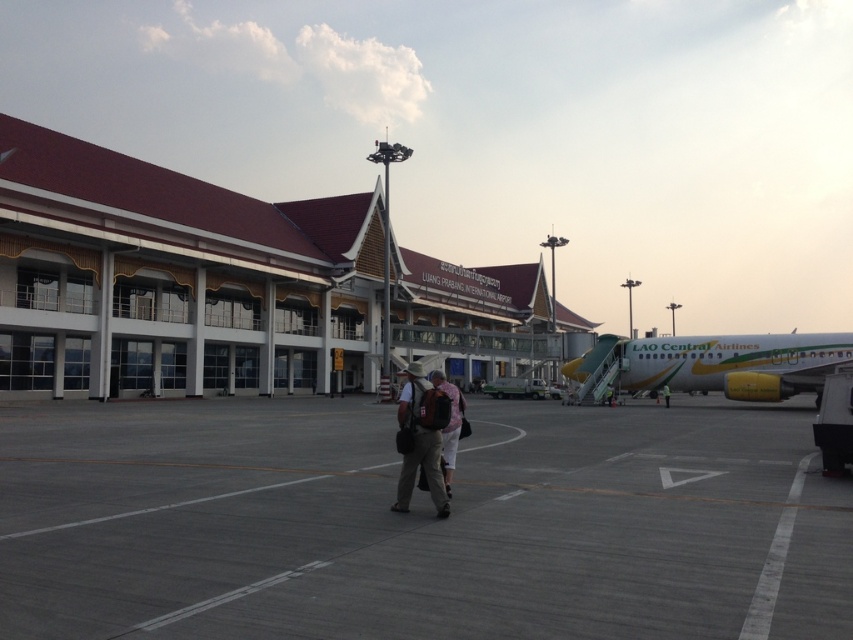
Please provide the coordinates of the gray asphalt tarmac at center in the image. The coordinates should be in the format of a tuple with two decimal numbers rounded to three decimal places, such as 0.123, 0.456.

The coordinates of the gray asphalt tarmac at center are at point (x=418, y=524).